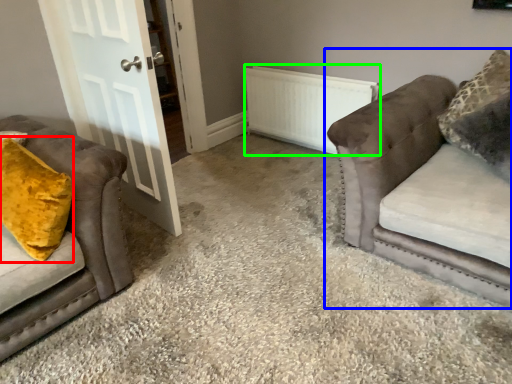
Question: Estimate the real-world distances between objects in this image. Which object is farther from throw pillow (highlighted by a red box), studio couch (highlighted by a blue box) or radiator (highlighted by a green box)?

Choices:
 (A) studio couch
 (B) radiator

Answer: (B)